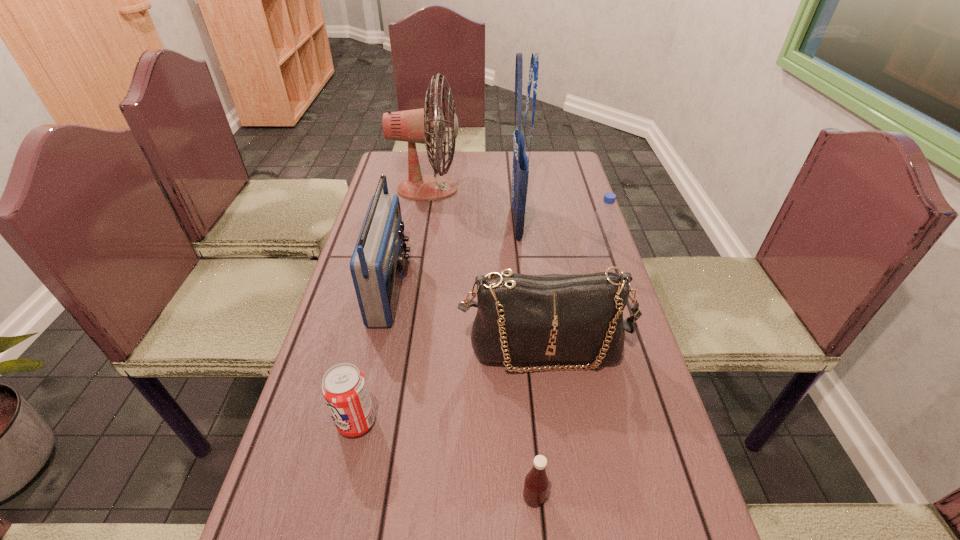
Locate an element on the screen. This screenshot has height=540, width=960. vacant region located in front of the second tallest object to direct airflow is located at coordinates (543, 190).

Where is `free space located 0.210m on the front panel of the radio receiver`? The image size is (960, 540). free space located 0.210m on the front panel of the radio receiver is located at coordinates (485, 288).

At what (x,y) coordinates should I click in order to perform the action: click on free space located 0.190m at the front of the handbag with chain and zipper. Please return your answer as a coordinate pair (x, y). The height and width of the screenshot is (540, 960). Looking at the image, I should click on pos(560,464).

Locate an element on the screen. The width and height of the screenshot is (960, 540). vacant space located on the front of the bottle is located at coordinates (621, 341).

Find the location of a particular element. The image size is (960, 540). vacant region located on the right of the second nearest object is located at coordinates (475, 422).

This screenshot has height=540, width=960. What are the coordinates of `vacant space located on the back of the nearest object` in the screenshot? It's located at (522, 361).

Where is `object present at the far edge`? The image size is (960, 540). object present at the far edge is located at coordinates (414, 126).

This screenshot has width=960, height=540. What are the coordinates of `fan situated at the left edge` in the screenshot? It's located at (414, 126).

At what (x,y) coordinates should I click in order to perform the action: click on radio receiver located at the left edge. Please return your answer as a coordinate pair (x, y). Image resolution: width=960 pixels, height=540 pixels. Looking at the image, I should click on (377, 263).

The image size is (960, 540). Identify the location of soda can present at the left edge. coord(344,388).